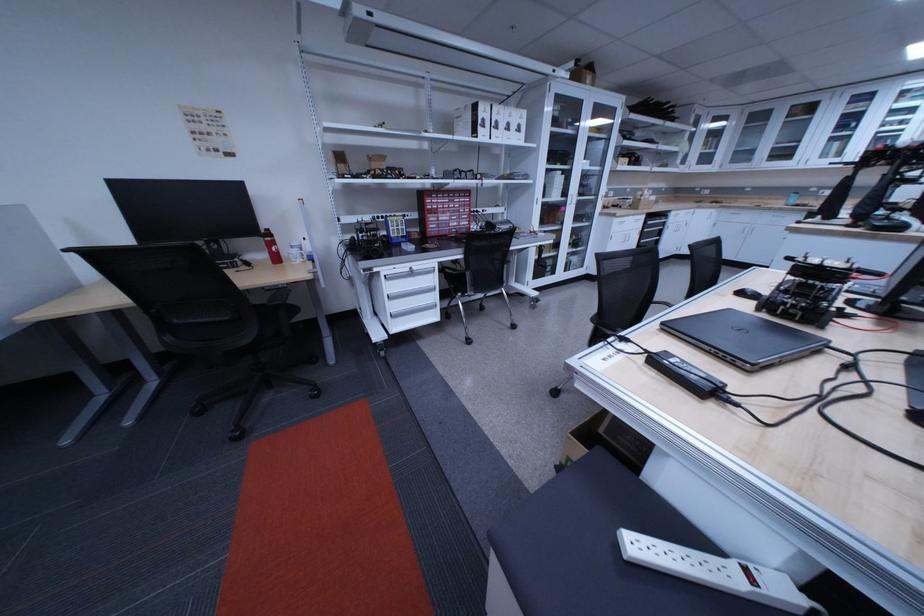
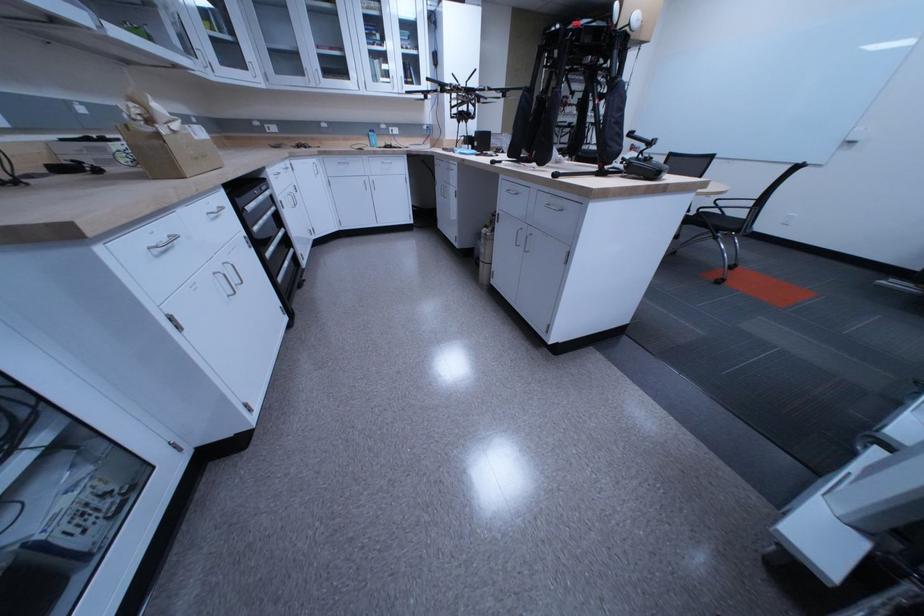
The point at (736,211) is marked in the first image. Where is the corresponding point in the second image?

(335, 159)